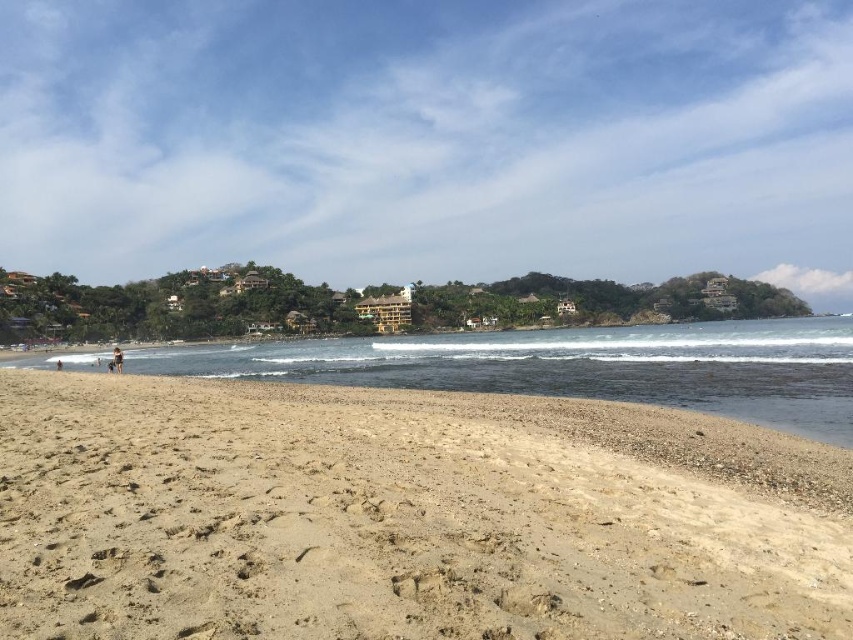
Question: Is the position of light brown sandy beach at lower left less distant than that of clear water at center?

Choices:
 (A) no
 (B) yes

Answer: (B)

Question: Which point is closer to the camera taking this photo?

Choices:
 (A) [x=498, y=572]
 (B) [x=763, y=349]

Answer: (A)

Question: Which object is closer to the camera taking this photo?

Choices:
 (A) clear water at center
 (B) light brown sandy beach at lower left

Answer: (B)

Question: Based on their relative distances, which object is nearer to the tan skin person at lower left?

Choices:
 (A) light brown sandy beach at lower left
 (B) clear water at center

Answer: (A)

Question: Is clear water at center wider than tan skin person at lower left?

Choices:
 (A) no
 (B) yes

Answer: (B)

Question: Is clear water at center smaller than tan skin person at lower left?

Choices:
 (A) yes
 (B) no

Answer: (B)